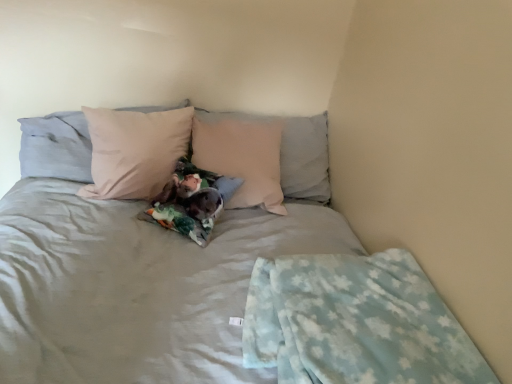
Identify the location of matte pink pillow at upper left, the 1th pillow viewed from the left. (56, 147).

Where is `matte pink pillow at upper left, acting as the second pillow starting from the right`? matte pink pillow at upper left, acting as the second pillow starting from the right is located at coordinates (56, 147).

From a real-world perspective, is light pink fabric pillow at center, which appears as the first pillow when viewed from the right, under light blue fleece blanket at lower right?

No.

Is light pink fabric pillow at center, which appears as the first pillow when viewed from the right, placed right next to light blue fleece blanket at lower right?

They are not placed beside each other.

From their relative heights in the image, would you say light pink fabric pillow at center, which appears as the first pillow when viewed from the right, is taller or shorter than light blue fleece blanket at lower right?

In the image, light pink fabric pillow at center, which appears as the first pillow when viewed from the right, appears to be taller than light blue fleece blanket at lower right.

From the image's perspective, is light pink fabric pillow at center, which appears as the first pillow when viewed from the right, located above or below light blue fleece blanket at lower right?

Clearly, from the image's perspective, light pink fabric pillow at center, which appears as the first pillow when viewed from the right, is above light blue fleece blanket at lower right.

Is light pink fabric pillow at center, acting as the 2th pillow starting from the left, at the back of light blue fleece blanket at lower right?

No, light blue fleece blanket at lower right is not facing the opposite direction of light pink fabric pillow at center, acting as the 2th pillow starting from the left.

Between light blue fleece blanket at lower right and light pink fabric pillow at center, acting as the 2th pillow starting from the left, which one appears on the left side from the viewer's perspective?

Positioned to the left is light pink fabric pillow at center, acting as the 2th pillow starting from the left.

Considering the sizes of objects light blue fleece blanket at lower right and light pink fabric pillow at center, acting as the 2th pillow starting from the left, in the image provided, who is shorter, light blue fleece blanket at lower right or light pink fabric pillow at center, acting as the 2th pillow starting from the left,?

With less height is light blue fleece blanket at lower right.

From a real-world perspective, which object stands above the other?

light pink fabric pillow at center, which appears as the first pillow when viewed from the right.

From the image's perspective, relative to light pink fabric pillow at center, which appears as the first pillow when viewed from the right, is matte pink pillow at upper left, the 1th pillow viewed from the left, above or below?

matte pink pillow at upper left, the 1th pillow viewed from the left, is situated higher than light pink fabric pillow at center, which appears as the first pillow when viewed from the right, in the image.

Is matte pink pillow at upper left, acting as the second pillow starting from the right, wider or thinner than light pink fabric pillow at center, acting as the 2th pillow starting from the left?

Considering their sizes, matte pink pillow at upper left, acting as the second pillow starting from the right, looks broader than light pink fabric pillow at center, acting as the 2th pillow starting from the left.

Is matte pink pillow at upper left, the 1th pillow viewed from the left, situated inside light pink fabric pillow at center, acting as the 2th pillow starting from the left, or outside?

matte pink pillow at upper left, the 1th pillow viewed from the left, is spatially situated outside light pink fabric pillow at center, acting as the 2th pillow starting from the left.

Considering the points (30, 132) and (289, 179), which point is in front, point (30, 132) or point (289, 179)?

The point (30, 132) is closer to the camera.

Considering the sizes of objects light pink fabric pillow at center, acting as the 2th pillow starting from the left, and matte pink pillow at upper left, acting as the second pillow starting from the right, in the image provided, who is thinner, light pink fabric pillow at center, acting as the 2th pillow starting from the left, or matte pink pillow at upper left, acting as the second pillow starting from the right,?

Thinner between the two is light pink fabric pillow at center, acting as the 2th pillow starting from the left.

Considering the relative positions of light pink fabric pillow at center, acting as the 2th pillow starting from the left, and matte pink pillow at upper left, the 1th pillow viewed from the left, in the image provided, is light pink fabric pillow at center, acting as the 2th pillow starting from the left, to the right of matte pink pillow at upper left, the 1th pillow viewed from the left, from the viewer's perspective?

Indeed, light pink fabric pillow at center, acting as the 2th pillow starting from the left, is positioned on the right side of matte pink pillow at upper left, the 1th pillow viewed from the left.

Could you tell me if light pink fabric pillow at center, acting as the 2th pillow starting from the left, is turned towards matte pink pillow at upper left, acting as the second pillow starting from the right?

No.

Is matte pink pillow at upper left, acting as the second pillow starting from the right, at the back of light blue fleece blanket at lower right?

No, light blue fleece blanket at lower right is not facing away from matte pink pillow at upper left, acting as the second pillow starting from the right.

What's the angular difference between light blue fleece blanket at lower right and matte pink pillow at upper left, the 1th pillow viewed from the left,'s facing directions?

The angle between the facing direction of light blue fleece blanket at lower right and the facing direction of matte pink pillow at upper left, the 1th pillow viewed from the left, is 0.724 degrees.

Is point (252, 280) positioned in front of point (66, 159)?

Yes, point (252, 280) is closer to viewer.

From a real-world perspective, is matte pink pillow at upper left, acting as the second pillow starting from the right, located beneath light blue fleece blanket at lower right?

Incorrect, from a real-world perspective, matte pink pillow at upper left, acting as the second pillow starting from the right, is higher than light blue fleece blanket at lower right.

From the image's perspective, between matte pink pillow at upper left, acting as the second pillow starting from the right, and light blue fleece blanket at lower right, who is located below?

light blue fleece blanket at lower right, from the image's perspective.

Is matte pink pillow at upper left, acting as the second pillow starting from the right, positioned in front of light blue fleece blanket at lower right?

No, matte pink pillow at upper left, acting as the second pillow starting from the right, is behind light blue fleece blanket at lower right.

Locate an element on the screen. The image size is (512, 384). blanket on the right of matte pink pillow at upper left, acting as the second pillow starting from the right is located at coordinates (355, 323).

The image size is (512, 384). What are the coordinates of `blanket on the right of light pink fabric pillow at center, acting as the 2th pillow starting from the left` in the screenshot? It's located at (355, 323).

Locate an element on the screen. Image resolution: width=512 pixels, height=384 pixels. blanket below the light pink fabric pillow at center, acting as the 2th pillow starting from the left (from a real-world perspective) is located at coordinates (355, 323).

In the scene shown: Based on their spatial positions, is light pink fabric pillow at center, which appears as the first pillow when viewed from the right, or light blue fleece blanket at lower right further from matte pink pillow at upper left, the 1th pillow viewed from the left?

The object further to matte pink pillow at upper left, the 1th pillow viewed from the left, is light blue fleece blanket at lower right.

Estimate the real-world distances between objects in this image. Which object is further from light pink fabric pillow at center, which appears as the first pillow when viewed from the right, light blue fleece blanket at lower right or matte pink pillow at upper left, the 1th pillow viewed from the left?

Based on the image, light blue fleece blanket at lower right appears to be further to light pink fabric pillow at center, which appears as the first pillow when viewed from the right.

Which object lies further to the anchor point light pink fabric pillow at center, which appears as the first pillow when viewed from the right, matte pink pillow at upper left, the 1th pillow viewed from the left, or light blue fleece blanket at lower right?

Among the two, light blue fleece blanket at lower right is located further to light pink fabric pillow at center, which appears as the first pillow when viewed from the right.

Based on their spatial positions, is matte pink pillow at upper left, the 1th pillow viewed from the left, or light pink fabric pillow at center, acting as the 2th pillow starting from the left, closer to light blue fleece blanket at lower right?

light pink fabric pillow at center, acting as the 2th pillow starting from the left, is closer to light blue fleece blanket at lower right.

Consider the image. From the image, which object appears to be farther from matte pink pillow at upper left, acting as the second pillow starting from the right, light blue fleece blanket at lower right or light pink fabric pillow at center, which appears as the first pillow when viewed from the right?

The object further to matte pink pillow at upper left, acting as the second pillow starting from the right, is light blue fleece blanket at lower right.

From the image, which object appears to be nearer to light blue fleece blanket at lower right, light pink fabric pillow at center, which appears as the first pillow when viewed from the right, or matte pink pillow at upper left, the 1th pillow viewed from the left?

Among the two, light pink fabric pillow at center, which appears as the first pillow when viewed from the right, is located nearer to light blue fleece blanket at lower right.

At what (x,y) coordinates should I click in order to perform the action: click on pillow located between light blue fleece blanket at lower right and light pink fabric pillow at center, which appears as the first pillow when viewed from the right, in the depth direction. Please return your answer as a coordinate pair (x, y). Looking at the image, I should click on (56, 147).